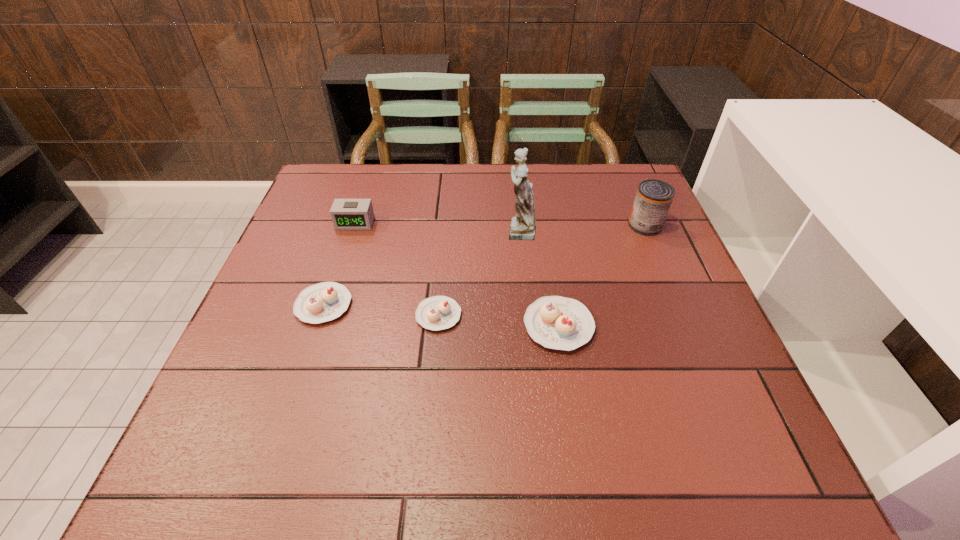
This screenshot has width=960, height=540. I want to click on free space between the can and the tallest object, so click(582, 228).

Identify the location of vacant area that lies between the rightmost cupcake and the tallest object. (539, 278).

This screenshot has height=540, width=960. I want to click on free space between the second cupcake from left to right and the can, so click(541, 270).

Where is `free space that is in between the tallest object and the can`? The width and height of the screenshot is (960, 540). free space that is in between the tallest object and the can is located at coordinates (582, 228).

Image resolution: width=960 pixels, height=540 pixels. What are the coordinates of `vacant space that's between the shortest object and the figurine` in the screenshot? It's located at (478, 273).

What are the coordinates of `vacant region between the shortest cupcake and the rightmost object` in the screenshot? It's located at (541, 270).

Identify the location of vacant area that lies between the alarm clock and the second cupcake from right to left. (396, 269).

Identify which object is the third closest to the second shortest object. Please provide its 2D coordinates. Your answer should be formatted as a tuple, i.e. [(x, y)], where the tuple contains the x and y coordinates of a point satisfying the conditions above.

[(522, 227)]

Locate an element on the screen. The height and width of the screenshot is (540, 960). object that is the second nearest to the alarm clock is located at coordinates (435, 313).

Locate which cupcake is the second closest to the tallest cupcake. Please provide its 2D coordinates. Your answer should be formatted as a tuple, i.e. [(x, y)], where the tuple contains the x and y coordinates of a point satisfying the conditions above.

[(326, 301)]